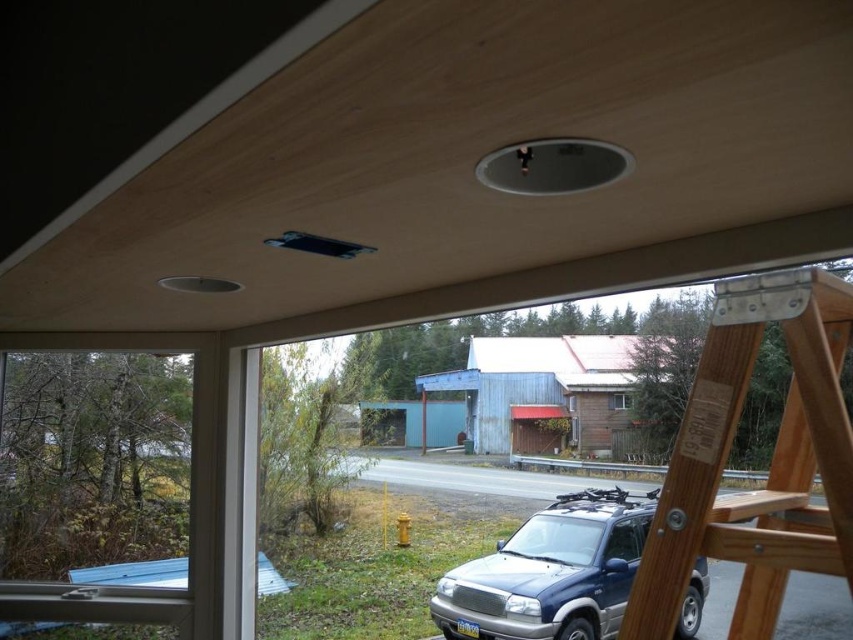
Can you confirm if wooden ladder at right is positioned to the right of metallic blue suv at lower right?

No, wooden ladder at right is not to the right of metallic blue suv at lower right.

Which is below, wooden ladder at right or metallic blue suv at lower right?

metallic blue suv at lower right is below.

Who is more forward, (819, 547) or (548, 532)?

Result: Positioned in front is point (819, 547).

Find the location of a particular element. The width and height of the screenshot is (853, 640). wooden ladder at right is located at coordinates (769, 465).

Is point (120, 385) positioned after point (514, 538)?

No, (120, 385) is in front of (514, 538).

Looking at this image, who is taller, clear glass window at left or metallic blue suv at lower right?

clear glass window at left

This screenshot has width=853, height=640. Describe the element at coordinates (96, 467) in the screenshot. I see `clear glass window at left` at that location.

In order to click on clear glass window at left in this screenshot , I will do `click(96, 467)`.

Does metallic blue suv at lower right have a larger size compared to brown wooden window at center?

Yes.

Identify the location of metallic blue suv at lower right. (550, 572).

The height and width of the screenshot is (640, 853). What are the coordinates of `metallic blue suv at lower right` in the screenshot? It's located at (550, 572).

Find the location of a particular element. Image resolution: width=853 pixels, height=640 pixels. metallic blue suv at lower right is located at coordinates (550, 572).